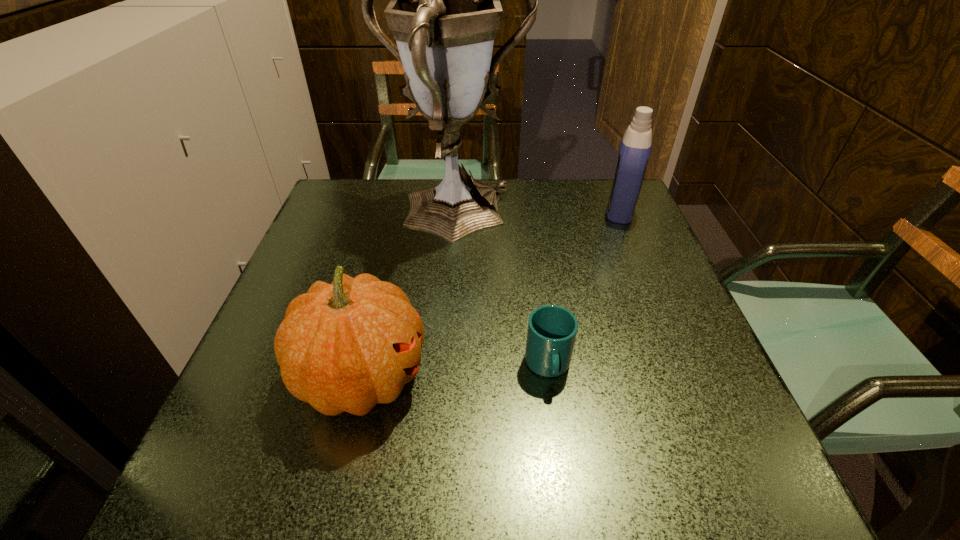
The width and height of the screenshot is (960, 540). In order to click on empty location between the rightmost object and the third tallest object in this screenshot , I will do `click(492, 294)`.

At what (x,y) coordinates should I click in order to perform the action: click on empty space between the rightmost object and the trophy cup. Please return your answer as a coordinate pair (x, y). This screenshot has width=960, height=540. Looking at the image, I should click on (538, 214).

Locate which object is the third closest to the pumpkin. Please provide its 2D coordinates. Your answer should be formatted as a tuple, i.e. [(x, y)], where the tuple contains the x and y coordinates of a point satisfying the conditions above.

[(635, 148)]

Locate an element on the screen. This screenshot has height=540, width=960. the second closest object to the cup is located at coordinates (446, 2).

I want to click on free space that satisfies the following two spatial constraints: 1. on the handle side of the cup; 2. on the carved face of the second shortest object, so click(550, 377).

At what (x,y) coordinates should I click in order to perform the action: click on free spot that satisfies the following two spatial constraints: 1. on the front side of the trophy cup; 2. on the carved face of the pumpkin. Please return your answer as a coordinate pair (x, y). This screenshot has width=960, height=540. Looking at the image, I should click on tap(442, 377).

The width and height of the screenshot is (960, 540). Identify the location of free space that satisfies the following two spatial constraints: 1. on the back side of the detergent; 2. on the right side of the trophy cup. (455, 211).

Find the location of a particular element. The width and height of the screenshot is (960, 540). free space that satisfies the following two spatial constraints: 1. on the handle side of the cup; 2. on the carved face of the pumpkin is located at coordinates (550, 377).